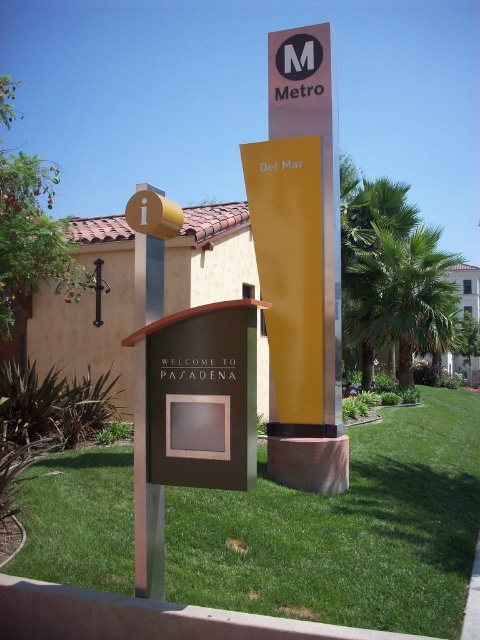
Is green grass at lower center thinner than yellow matte sign at upper center?

Incorrect, green grass at lower center's width is not less than yellow matte sign at upper center's.

Measure the distance between point (462, 531) and camera.

5.18 meters

Does point (422, 605) come farther from viewer compared to point (316, 280)?

No.

The height and width of the screenshot is (640, 480). I want to click on green grass at lower center, so (346, 531).

Describe the element at coordinates (346, 531) in the screenshot. I see `green grass at lower center` at that location.

What are the coordinates of `green grass at lower center` in the screenshot? It's located at (346, 531).

Can you confirm if yellow matte sign at upper center is positioned to the left of metallic yellow sign at center?

Indeed, yellow matte sign at upper center is positioned on the left side of metallic yellow sign at center.

Between yellow matte sign at upper center and metallic yellow sign at center, which one is positioned lower?

yellow matte sign at upper center is below.

Is point (272, 196) positioned after point (331, 88)?

Yes, it is.

The height and width of the screenshot is (640, 480). I want to click on yellow matte sign at upper center, so tap(288, 268).